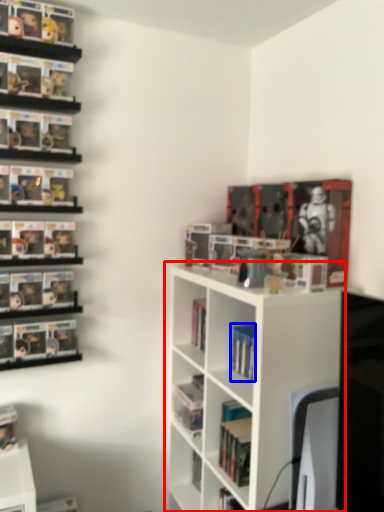
Question: Which object is further to the camera taking this photo, shelf (highlighted by a red box) or book (highlighted by a blue box)?

Choices:
 (A) shelf
 (B) book

Answer: (B)